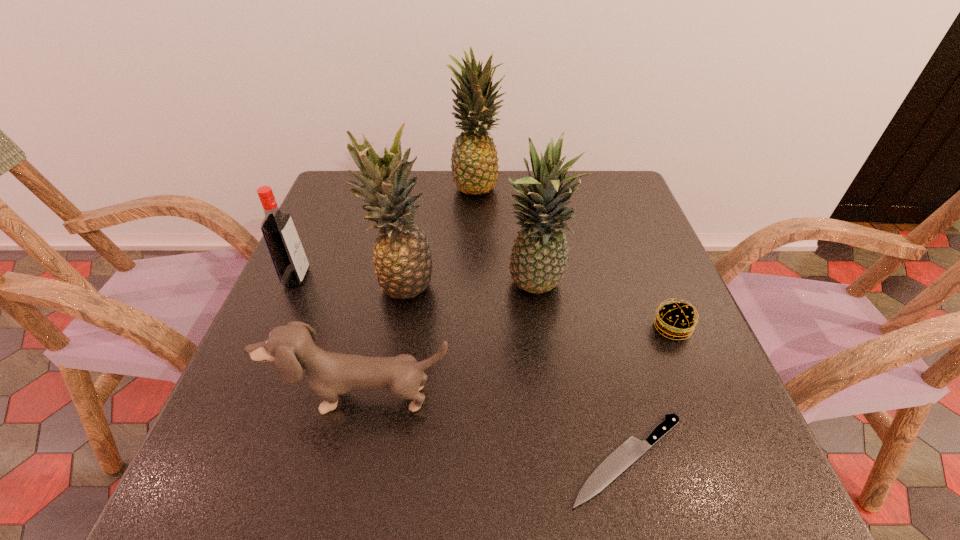
You are a GUI agent. You are given a task and a screenshot of the screen. Output one action in this format:
    pyautogui.click(x=<x>, y=<y>)
    Task: Click on the object that is at the near right corner
    The image size is (960, 540).
    Given the screenshot: What is the action you would take?
    pyautogui.click(x=627, y=453)

The image size is (960, 540). In the image, there is a desktop. In order to click on vacant space at the far edge in this screenshot , I will do `click(424, 194)`.

This screenshot has height=540, width=960. What are the coordinates of `vacant area at the near edge of the desktop` in the screenshot? It's located at (596, 462).

You are a GUI agent. You are given a task and a screenshot of the screen. Output one action in this format:
    pyautogui.click(x=<x>, y=<y>)
    Task: Click on the free space at the left edge
    
    Given the screenshot: What is the action you would take?
    [x=342, y=264]

I want to click on free spot at the right edge of the desktop, so click(634, 238).

Locate an element on the screen. The width and height of the screenshot is (960, 540). free region at the far right corner of the desktop is located at coordinates (592, 173).

Where is `unoccupied position between the third nearest object and the shortest object`? unoccupied position between the third nearest object and the shortest object is located at coordinates (650, 394).

At what (x,y) coordinates should I click in order to perform the action: click on empty space between the leftmost pineapple and the third shortest object. Please return your answer as a coordinate pair (x, y). The image size is (960, 540). Looking at the image, I should click on (383, 341).

Locate an element on the screen. unoccupied position between the patty and the leftmost pineapple is located at coordinates (539, 306).

Locate an element on the screen. free spot between the fifth tallest object and the leftmost object is located at coordinates (329, 338).